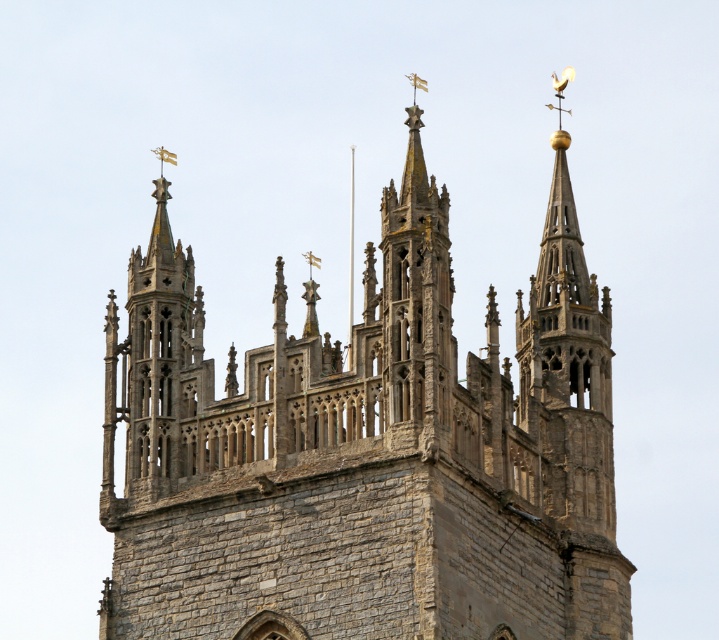
You are standing in front of the historic stone church tower and notice two prominent structures. The gray stone church at center and the stone spire at upper left. Based on the architectural layout, which of these two structures is positioned to the right side from your viewpoint?

The gray stone church at center is positioned to the right of the stone spire at upper left, so the gray stone church at center is the one on the right side from your viewpoint.

You are standing at the base of the church tower. If you look up towards the top, where would you see the gray stone church at center?

The gray stone church at center is located at point [367,451], which would be slightly to the right and above the center of your field of view.

You are an architect examining the church tower. You notice two points marked on the tower structure. Which point, point (x=278, y=346) or point (x=193, y=323), is physically closer to you as you stand in front of the tower?

Point (x=278, y=346) is closer to the viewer than point (x=193, y=323).